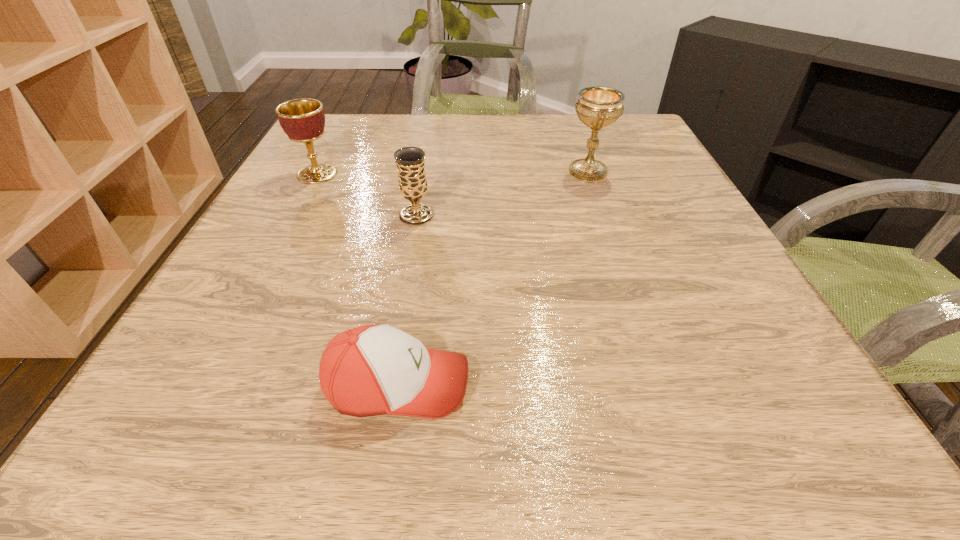
Where is `free space between the rightmost object and the leftmost object`? free space between the rightmost object and the leftmost object is located at coordinates (452, 173).

Locate an element on the screen. This screenshot has height=540, width=960. vacant area between the second chalice from right to left and the rightmost chalice is located at coordinates (502, 193).

Where is `vacant point located between the nearest chalice and the leftmost chalice`? vacant point located between the nearest chalice and the leftmost chalice is located at coordinates (367, 194).

Locate an element on the screen. Image resolution: width=960 pixels, height=540 pixels. vacant area between the second nearest object and the shortest object is located at coordinates (407, 300).

Locate an element on the screen. free space between the second nearest object and the baseball cap is located at coordinates (407, 300).

Identify the location of free space between the rightmost object and the nearest chalice. The height and width of the screenshot is (540, 960). (502, 193).

Identify the location of free space that is in between the rightmost object and the baseball cap. The image size is (960, 540). (492, 278).

At what (x,y) coordinates should I click in order to perform the action: click on free space between the leftmost chalice and the rightmost chalice. Please return your answer as a coordinate pair (x, y). Looking at the image, I should click on (452, 173).

At what (x,y) coordinates should I click in order to perform the action: click on free space between the second nearest object and the rightmost chalice. Please return your answer as a coordinate pair (x, y). Looking at the image, I should click on (502, 193).

Identify which object is located as the second nearest to the leftmost object. Please provide its 2D coordinates. Your answer should be formatted as a tuple, i.e. [(x, y)], where the tuple contains the x and y coordinates of a point satisfying the conditions above.

[(370, 370)]